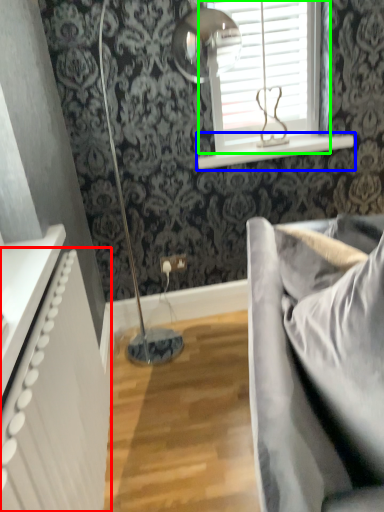
Question: Estimate the real-world distances between objects in this image. Which object is closer to radiator (highlighted by a red box), window sill (highlighted by a blue box) or window (highlighted by a green box)?

Choices:
 (A) window sill
 (B) window

Answer: (A)